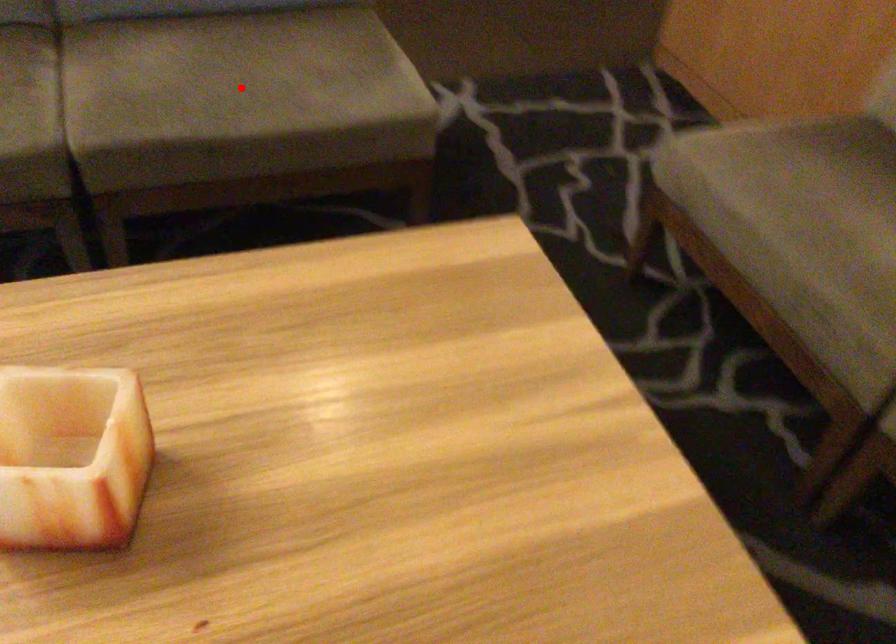
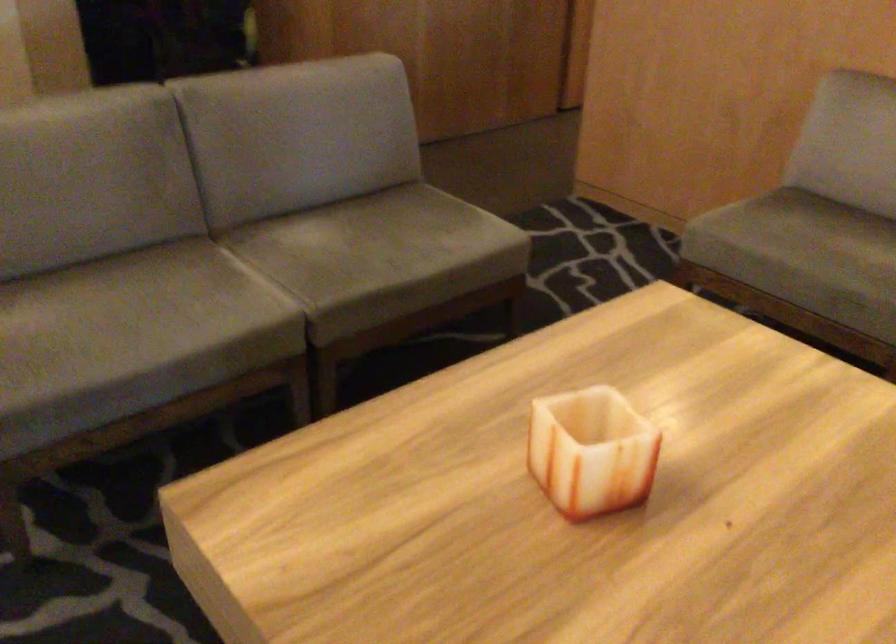
Question: I am providing you with two images of the same scene from different viewpoints. A red point is shown in image1. For the corresponding object point in image2, is it positioned nearer or farther from the camera?

Choices:
 (A) Nearer
 (B) Farther

Answer: (B)